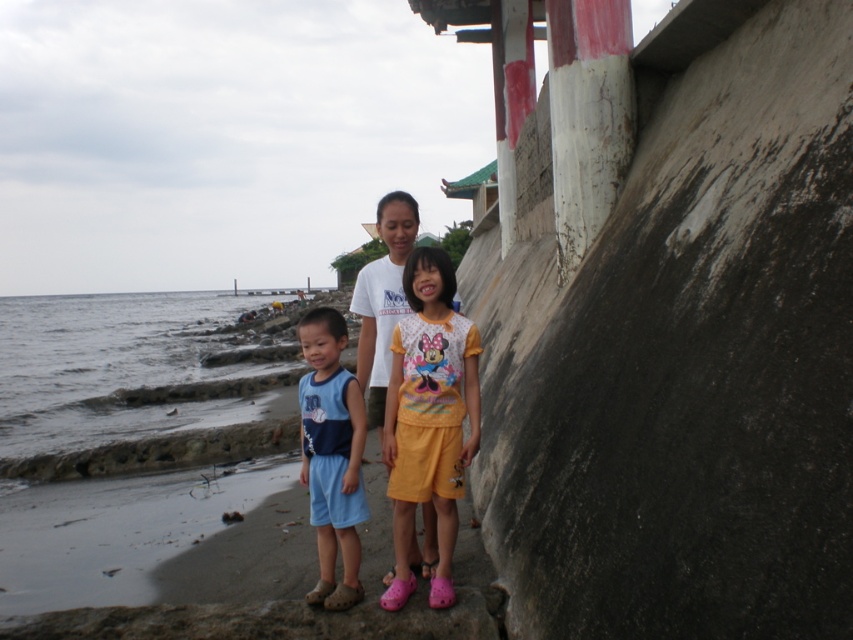
You are a photographer trying to capture a photo of the yellow cotton shorts at center and the blue fabric shorts at center. Which pair of shorts should you focus on first if you want to capture the larger one in the frame?

The yellow cotton shorts at center is bigger than the blue fabric shorts at center, so you should focus on the yellow cotton shorts at center first to capture the larger one in the frame.

You are standing at the water edge and want to walk towards the two points marked in the image. Which point, point (395,364) or point (321,442), is closer to you?

Point (395,364) is closer to you because it is further to the viewer than point (321,442).

You are a photographer trying to capture the yellow cotton shorts at center in the frame. Based on the coordinates provided, where should you position your camera to ensure the shorts are centered in the image?

The yellow cotton shorts at center are located at coordinates point (428, 417), so positioning the camera to center on those coordinates will ensure the shorts are centered in the image.